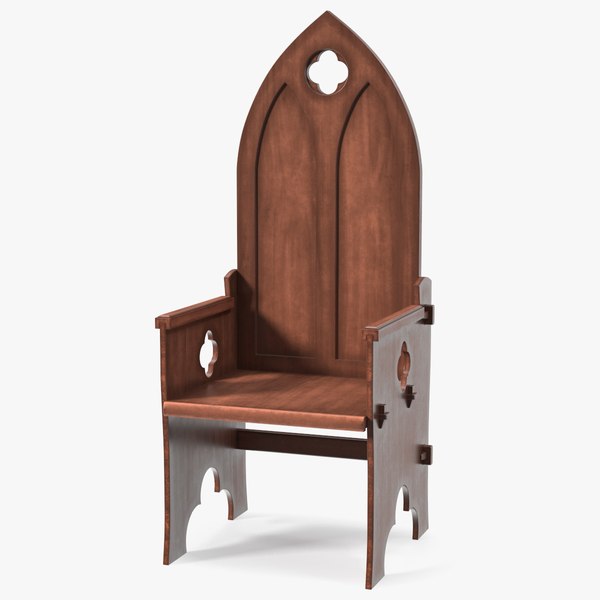
The image size is (600, 600). Identify the location of thin seat. (313, 409).